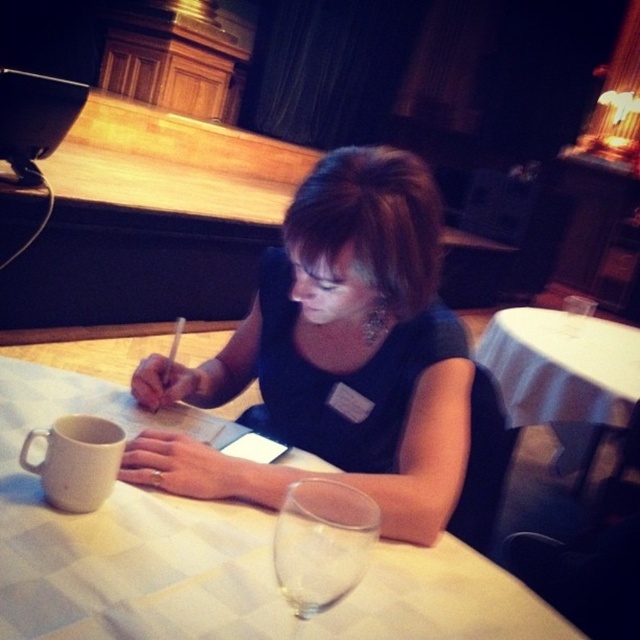
The width and height of the screenshot is (640, 640). Describe the element at coordinates (208, 554) in the screenshot. I see `white checkered tablecloth at center` at that location.

Is white checkered tablecloth at center shorter than white cloth-covered table at center?

Yes, white checkered tablecloth at center is shorter than white cloth-covered table at center.

Locate an element on the screen. This screenshot has height=640, width=640. white checkered tablecloth at center is located at coordinates (208, 554).

Find the location of a particular element. This screenshot has height=640, width=640. white checkered tablecloth at center is located at coordinates pyautogui.click(x=208, y=554).

Which is in front, point (598, 328) or point (83, 468)?

Point (83, 468)

Which is in front, point (548, 326) or point (68, 461)?

Point (68, 461)

Image resolution: width=640 pixels, height=640 pixels. What are the coordinates of `white cloth-covered table at center` in the screenshot? It's located at (561, 374).

How far apart are matte black dress at center and white cloth-covered table at center?

A distance of 1.32 meters exists between matte black dress at center and white cloth-covered table at center.

Where is `matte black dress at center`? The image size is (640, 640). matte black dress at center is located at coordinates (353, 340).

Identify the location of matte black dress at center. (353, 340).